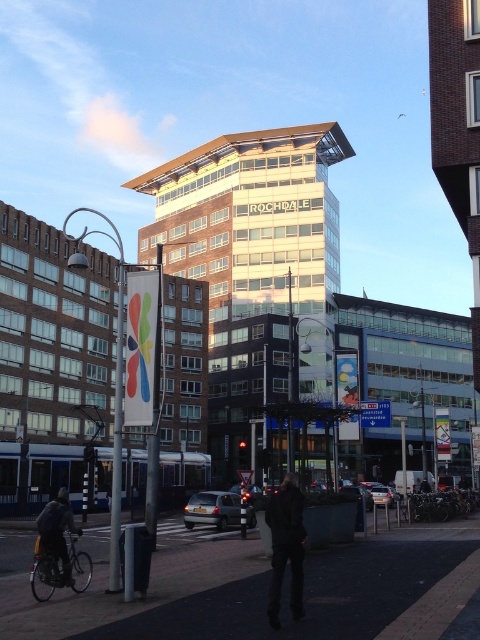
You are a delivery person needing to navigate through the urban street scene. The white plastic banner at center and the dark blue jacket at lower left are both in your path. Which object should you avoid hitting first based on their sizes?

The dark blue jacket at lower left should be avoided first since it is smaller than the white plastic banner at center, making it closer to you and requiring immediate attention.

You are standing at the point with coordinates point (289, 532) and want to walk to the point with coordinates point (48, 509). Which direction should you move to get closer to your destination?

You should move away from the camera because point (289, 532) is closer to the camera than point (48, 509).